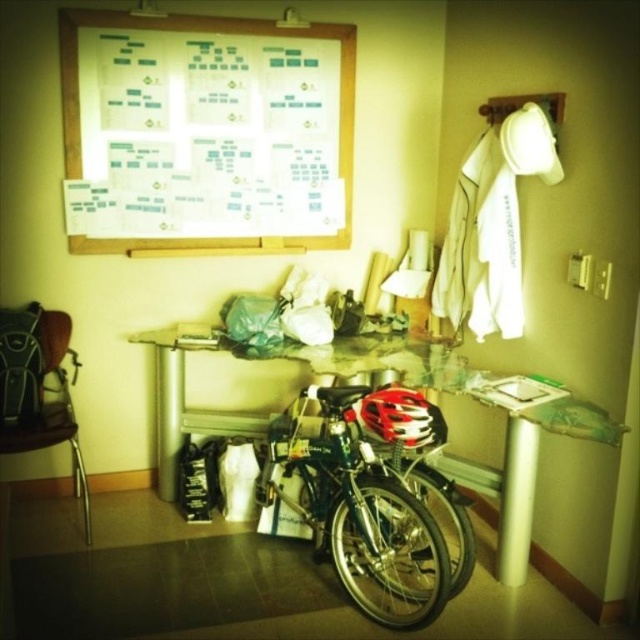
Does white paperboard at upper center have a greater height compared to shiny metallic bicycle at center?

Indeed, white paperboard at upper center has a greater height compared to shiny metallic bicycle at center.

Does point (248, 118) lie behind point (353, 465)?

That is True.

The height and width of the screenshot is (640, 640). Find the location of `white paperboard at upper center`. white paperboard at upper center is located at coordinates (205, 132).

Who is lower down, shiny metallic bicycle at center or red matte bicycle helmet at center?

shiny metallic bicycle at center is lower down.

Between shiny metallic bicycle at center and red matte bicycle helmet at center, which one has more height?

With more height is shiny metallic bicycle at center.

This screenshot has width=640, height=640. In order to click on shiny metallic bicycle at center in this screenshot , I will do `click(358, 513)`.

Does shiny metallic bicycle at center have a larger size compared to metallic silver table at center?

Actually, shiny metallic bicycle at center might be smaller than metallic silver table at center.

Looking at this image, who is shorter, shiny metallic bicycle at center or metallic silver table at center?

With less height is shiny metallic bicycle at center.

This screenshot has width=640, height=640. Describe the element at coordinates (358, 513) in the screenshot. I see `shiny metallic bicycle at center` at that location.

Where is `shiny metallic bicycle at center`? shiny metallic bicycle at center is located at coordinates (358, 513).